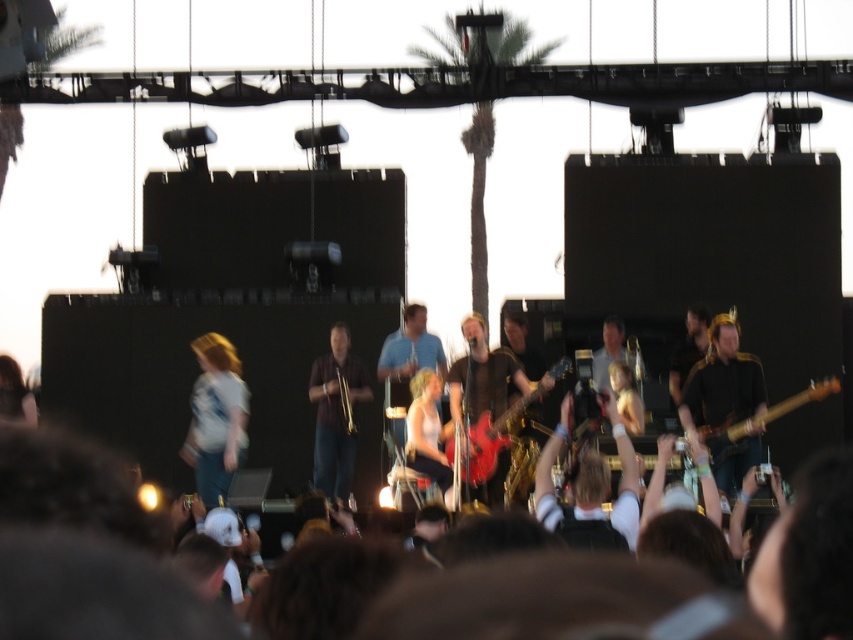
In the scene shown: How distant is shiny red electric guitar at center from brown wooden guitar at right?

A distance of 66.62 feet exists between shiny red electric guitar at center and brown wooden guitar at right.

Consider the image. Does shiny red electric guitar at center have a lesser width compared to brown wooden guitar at right?

Yes, shiny red electric guitar at center is thinner than brown wooden guitar at right.

Where is `shiny red electric guitar at center`? The height and width of the screenshot is (640, 853). shiny red electric guitar at center is located at coordinates (494, 429).